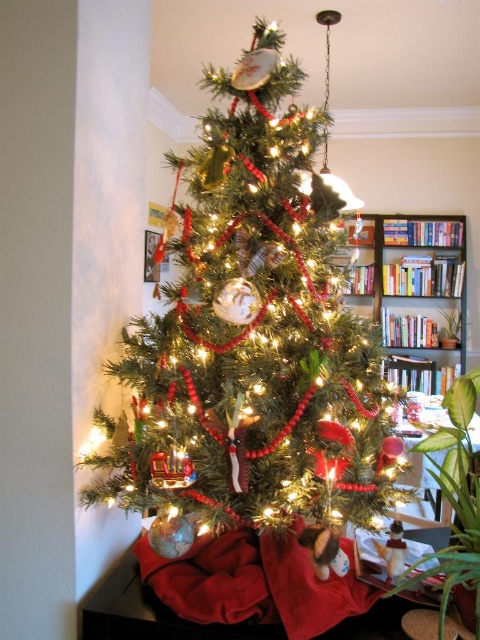
Does green matte christmas tree at center appear over wooden bookshelf at center?

No.

Where is `green matte christmas tree at center`? green matte christmas tree at center is located at coordinates (252, 336).

You are a GUI agent. You are given a task and a screenshot of the screen. Output one action in this format:
    pyautogui.click(x=<x>, y=<y>)
    Task: Click on the green matte christmas tree at center
    The image size is (480, 640).
    Given the screenshot: What is the action you would take?
    pyautogui.click(x=252, y=336)

Image resolution: width=480 pixels, height=640 pixels. Identify the location of green matte christmas tree at center. (252, 336).